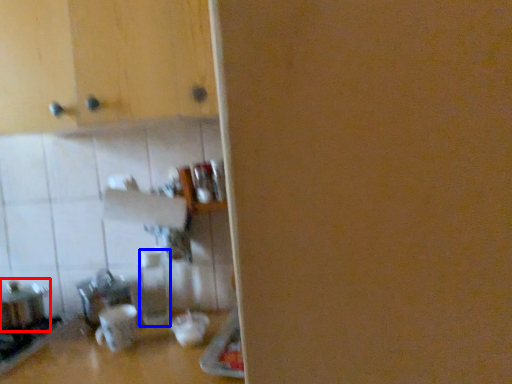
Question: Among these objects, which one is nearest to the camera, appliance (highlighted by a red box) or bottle (highlighted by a blue box)?

Choices:
 (A) appliance
 (B) bottle

Answer: (A)